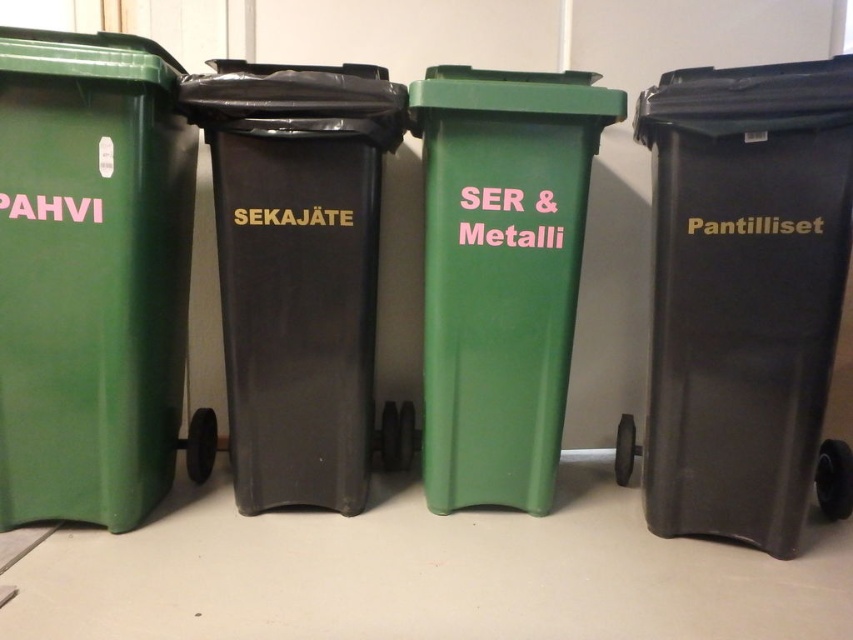
Question: Can you confirm if black plastic recycling bin at right is bigger than green plastic pahvi at left?

Choices:
 (A) yes
 (B) no

Answer: (A)

Question: Does green plastic pahvi at left have a smaller size compared to green matte recycling bin at center?

Choices:
 (A) yes
 (B) no

Answer: (B)

Question: Which object is the closest to the green matte recycling bin at center?

Choices:
 (A) black plastic recycling bin at right
 (B) black plastic bin at center

Answer: (B)

Question: Which object is positioned closest to the black plastic recycling bin at right?

Choices:
 (A) green matte recycling bin at center
 (B) black plastic bin at center

Answer: (A)

Question: Is black plastic recycling bin at right bigger than green matte recycling bin at center?

Choices:
 (A) yes
 (B) no

Answer: (A)

Question: Based on their relative distances, which object is farther from the green matte recycling bin at center?

Choices:
 (A) green plastic pahvi at left
 (B) black plastic bin at center
 (C) black plastic recycling bin at right

Answer: (A)